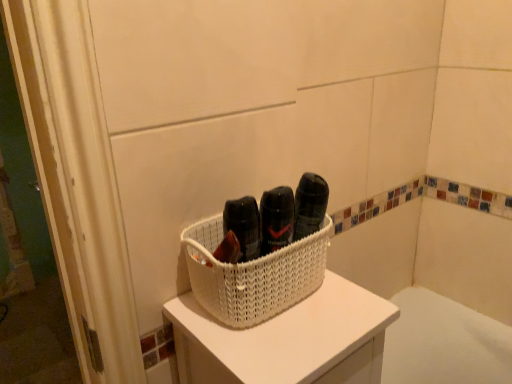
Where is `free location in front of white woven basket at center`? The height and width of the screenshot is (384, 512). free location in front of white woven basket at center is located at coordinates (282, 345).